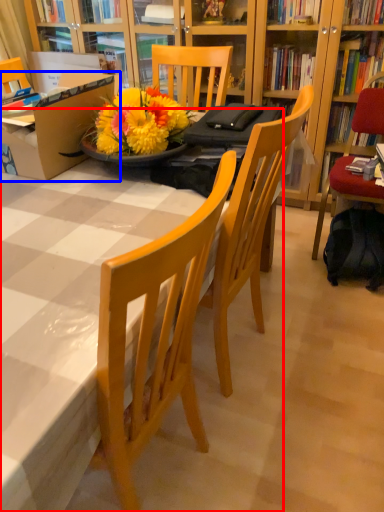
Question: Which object is closer to the camera taking this photo, desk (highlighted by a red box) or box (highlighted by a blue box)?

Choices:
 (A) desk
 (B) box

Answer: (A)